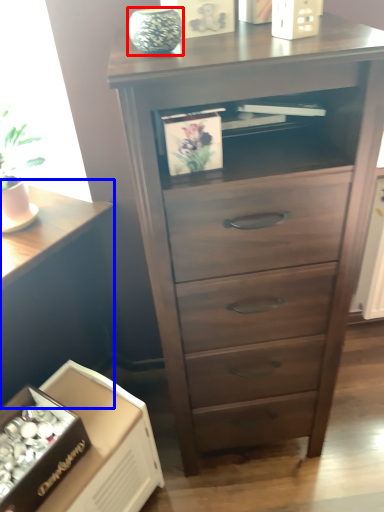
Question: Which object appears closest to the camera in this image, glass vase (highlighted by a red box) or table (highlighted by a blue box)?

Choices:
 (A) glass vase
 (B) table

Answer: (A)